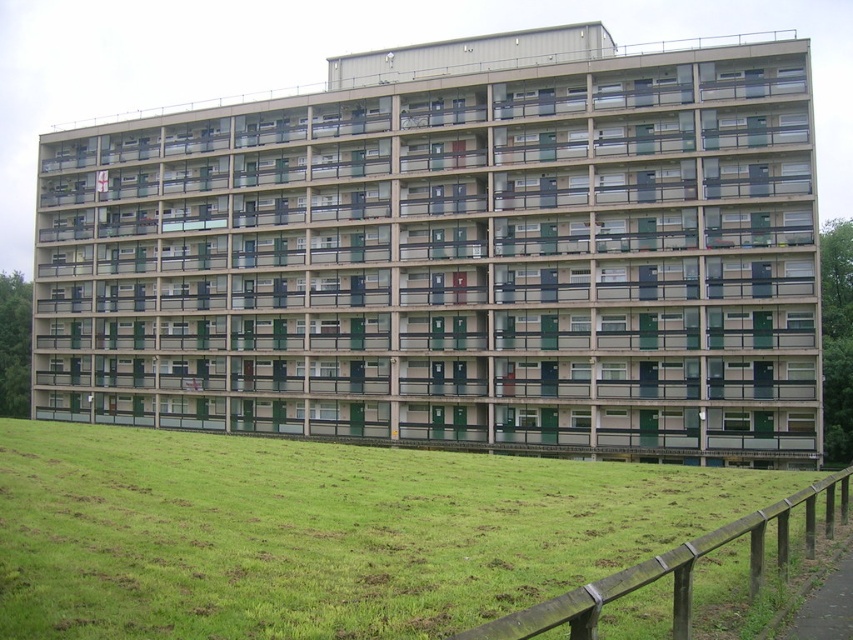
In the scene shown: You are a landscape architect designing a garden for the area around the residential building. You have two options for ground cover in the lower section of the property. The green grass at lower center and the wooden at lower right. Which option covers a larger area?

The green grass at lower center is bigger than the wooden at lower right, so it covers a larger area.

You are standing in front of the residential building and notice green grass at lower center and wooden at lower right. Which object is positioned to the left of the other?

The green grass at lower center is positioned to the left of the wooden at lower right.

You are a landscape architect designing a garden for the area around the residential building. You have two options for ground cover in the lower section of the property. The green grass at lower center and the wooden at lower right. Which option would you choose if you want the ground cover to be taller?

The green grass at lower center is taller than the wooden at lower right, so you should choose the green grass at lower center for a taller ground cover.